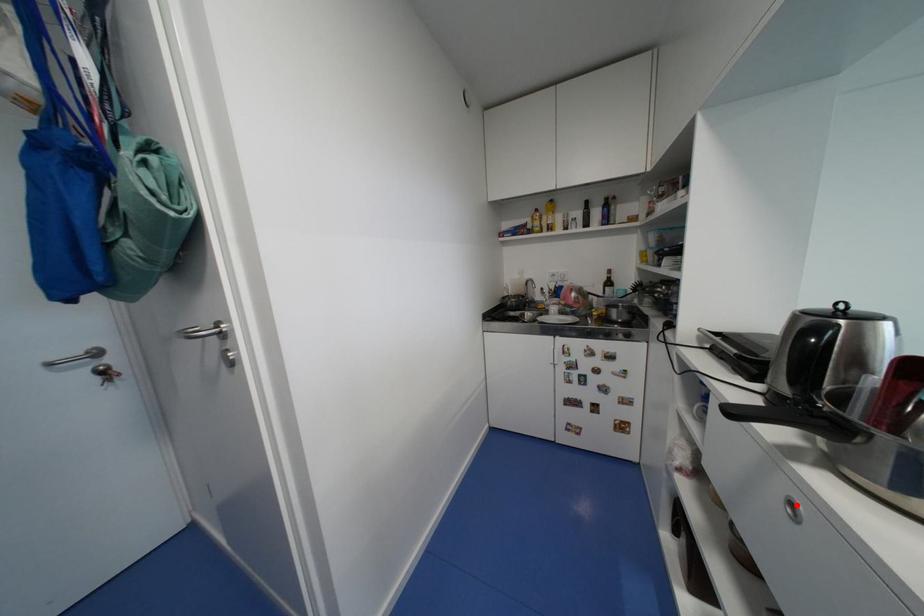
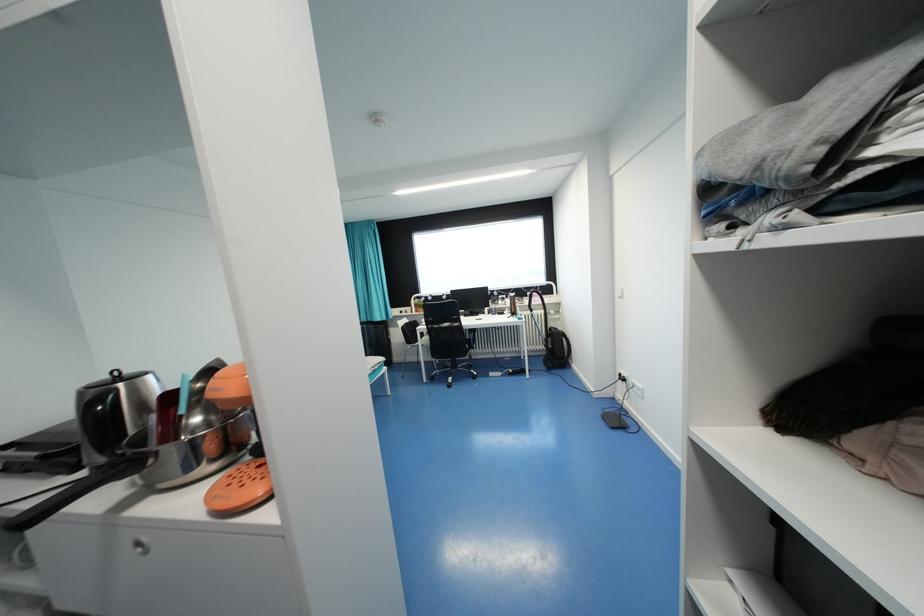
Question: I am providing you with two images of the same scene from different viewpoints. Image1 has a red point marked. In image2, the corresponding 3D location appears at what relative position? Reply with the corresponding letter.

Choices:
 (A) Closer
 (B) Farther

Answer: (A)